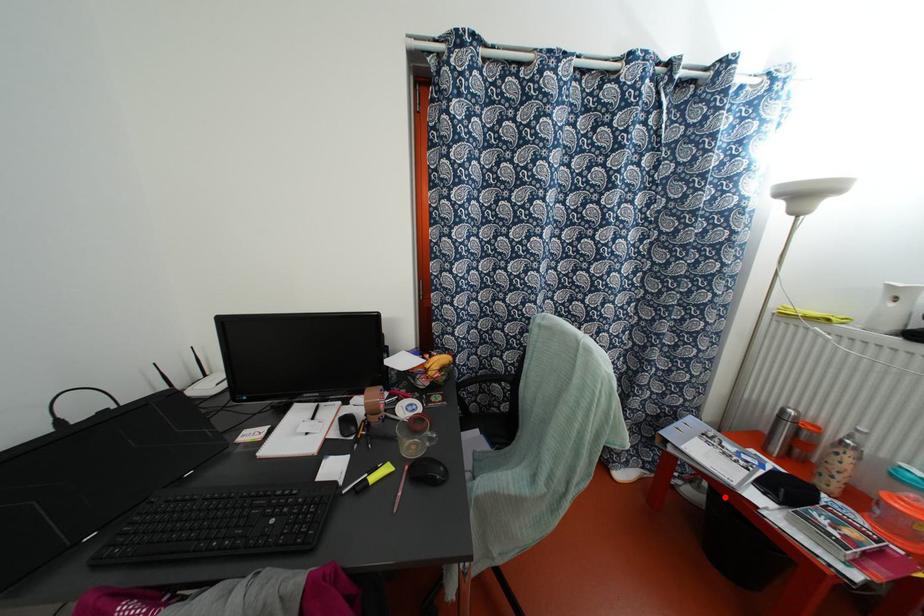
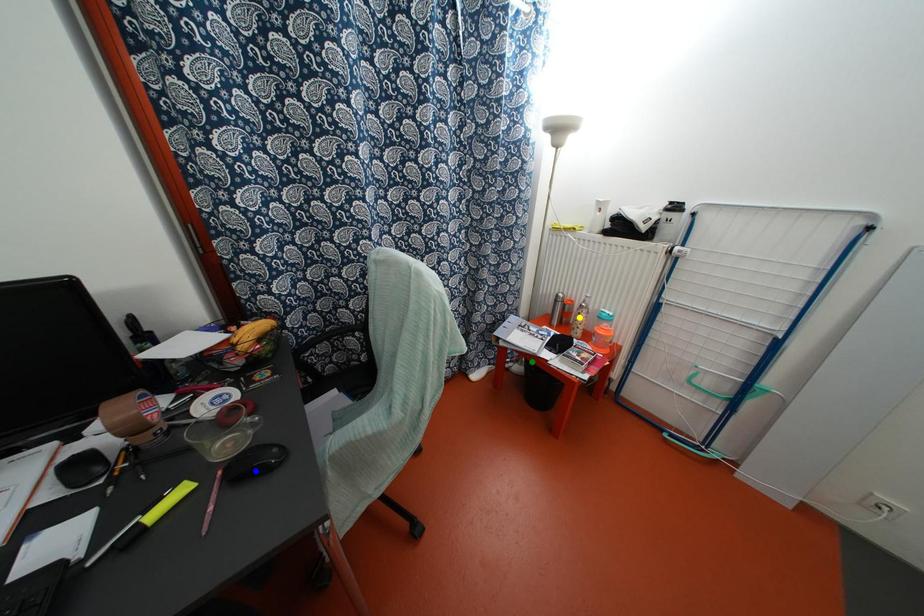
Question: I am providing you with two images of the same scene from different viewpoints. A red point is marked on the first image. You are given multiple points on the second image. Which point in image 2 represents the same 3d spot as the red point in image 1?

Choices:
 (A) yellow point
 (B) green point
 (C) blue point

Answer: (B)